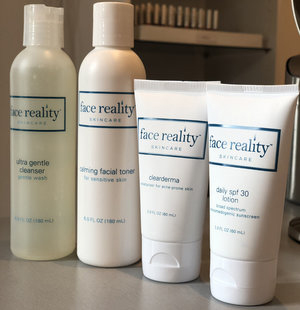
Where is `lotion`? Image resolution: width=300 pixels, height=310 pixels. lotion is located at coordinates (233, 208).